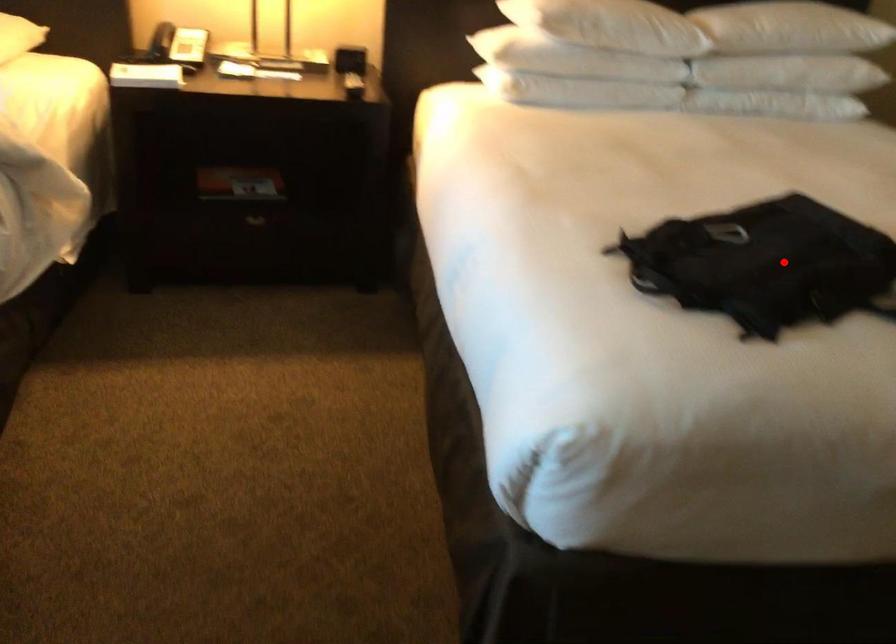
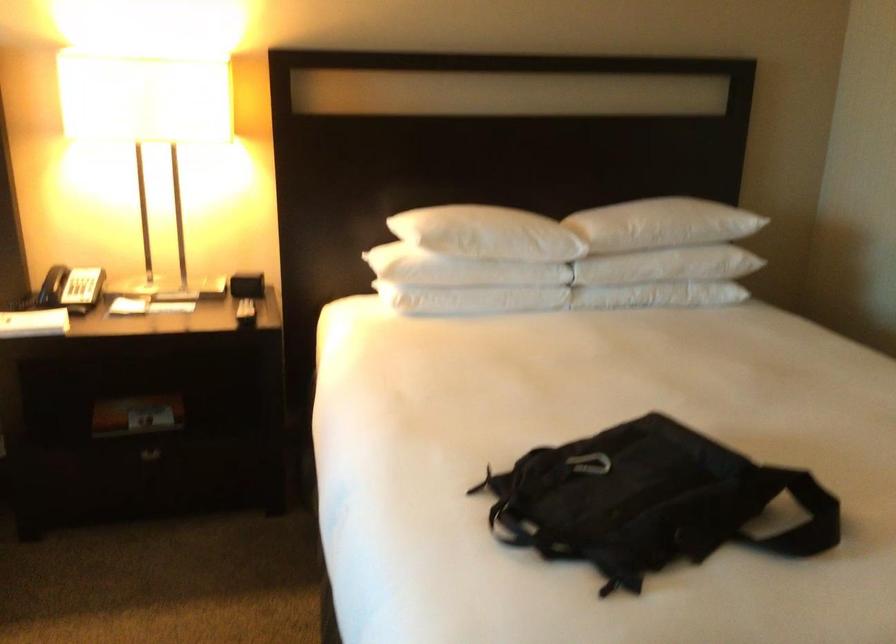
Where in the second image is the point corresponding to the highlighted location from the first image?

(649, 502)